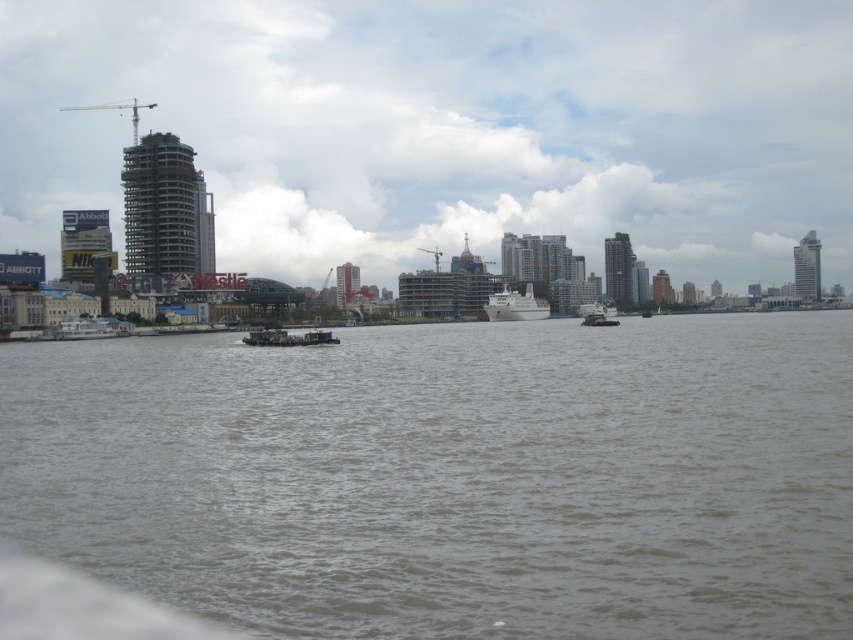
Question: Does white glossy ship at center have a lesser width compared to white matte boat at center?

Choices:
 (A) yes
 (B) no

Answer: (A)

Question: Can you confirm if white matte barge at left is smaller than white matte boat at center?

Choices:
 (A) yes
 (B) no

Answer: (A)

Question: Considering the real-world distances, which object is closest to the metallic gray barge at center?

Choices:
 (A) gray water at center
 (B) white matte boat at center
 (C) white glossy ship at center
 (D) white matte barge at left

Answer: (A)

Question: Can you confirm if white glossy ship at center is thinner than white matte boat at center?

Choices:
 (A) yes
 (B) no

Answer: (A)

Question: Considering the real-world distances, which object is farthest from the white matte barge at left?

Choices:
 (A) metallic gray barge at center
 (B) white glossy ship at center
 (C) white matte boat at center
 (D) gray water at center

Answer: (B)

Question: Which of the following is the farthest from the observer?

Choices:
 (A) (581, 312)
 (B) (70, 333)
 (C) (164, 528)
 (D) (273, 332)

Answer: (A)